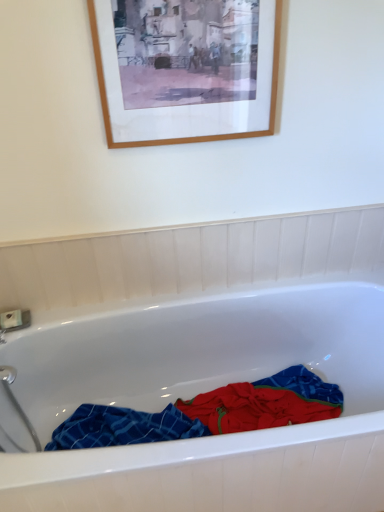
Question: In terms of width, does blue plaid towel at center look wider or thinner when compared to wooden picture frame at upper center?

Choices:
 (A) wide
 (B) thin

Answer: (A)

Question: From the image's perspective, is blue plaid towel at center above or below wooden picture frame at upper center?

Choices:
 (A) above
 (B) below

Answer: (B)

Question: Based on their relative distances, which object is nearer to the white glossy bathtub at center?

Choices:
 (A) blue plaid towel at center
 (B) wooden picture frame at upper center

Answer: (A)

Question: Which object is positioned farthest from the white glossy bathtub at center?

Choices:
 (A) blue plaid towel at center
 (B) wooden picture frame at upper center

Answer: (B)